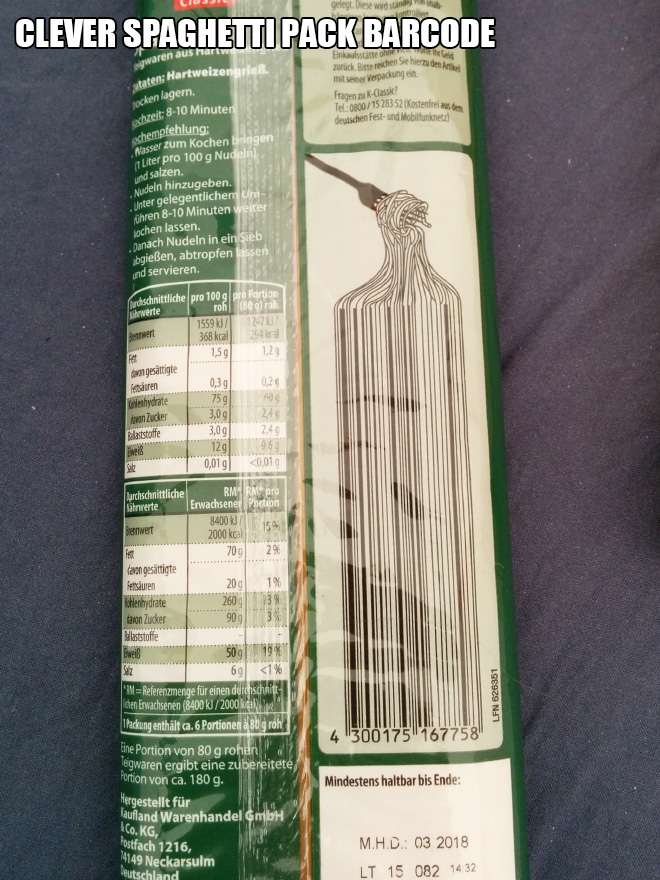
Find the location of a particular element. The image size is (660, 880). fork is located at coordinates (362, 194).